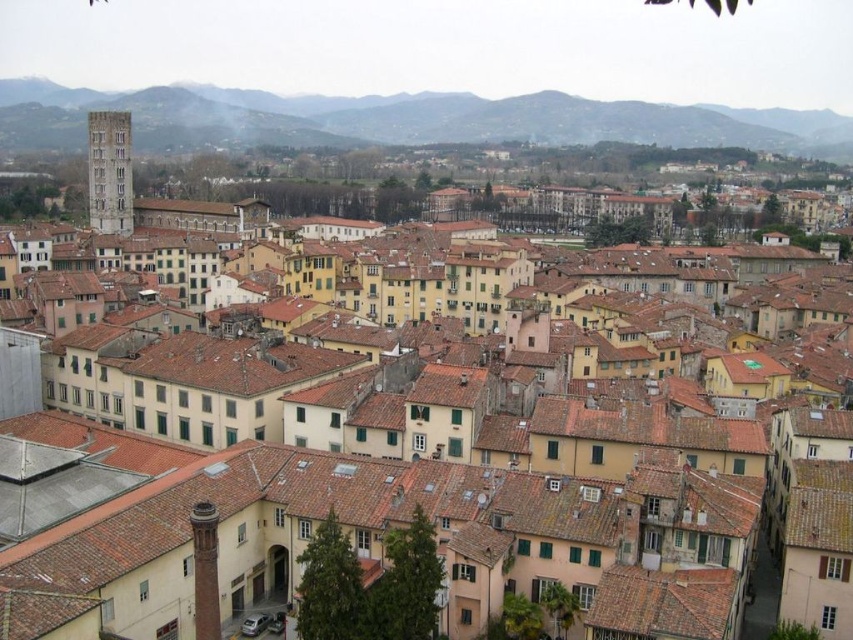
Question: Does brown grassy hillside at upper center appear over smooth stone tower at left?

Choices:
 (A) yes
 (B) no

Answer: (A)

Question: Does brown grassy hillside at upper center appear on the left side of smooth stone tower at left?

Choices:
 (A) yes
 (B) no

Answer: (B)

Question: Which point appears farthest from the camera in this image?

Choices:
 (A) (697, 136)
 (B) (93, 186)

Answer: (A)

Question: Which point is farther to the camera?

Choices:
 (A) (93, 154)
 (B) (181, 88)

Answer: (B)

Question: Does brown grassy hillside at upper center come behind smooth stone tower at left?

Choices:
 (A) yes
 (B) no

Answer: (A)

Question: Which object is farther from the camera taking this photo?

Choices:
 (A) smooth stone tower at left
 (B) brown grassy hillside at upper center

Answer: (B)